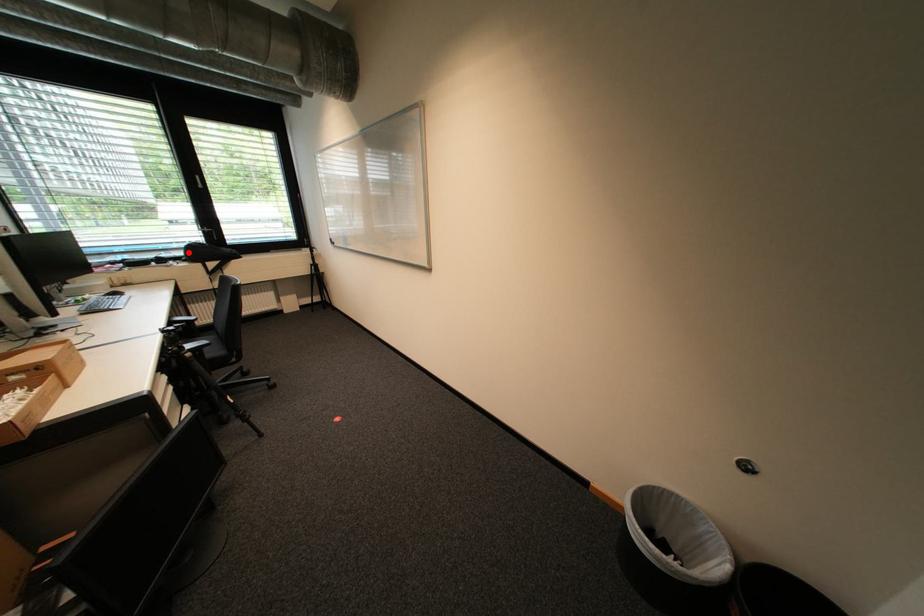
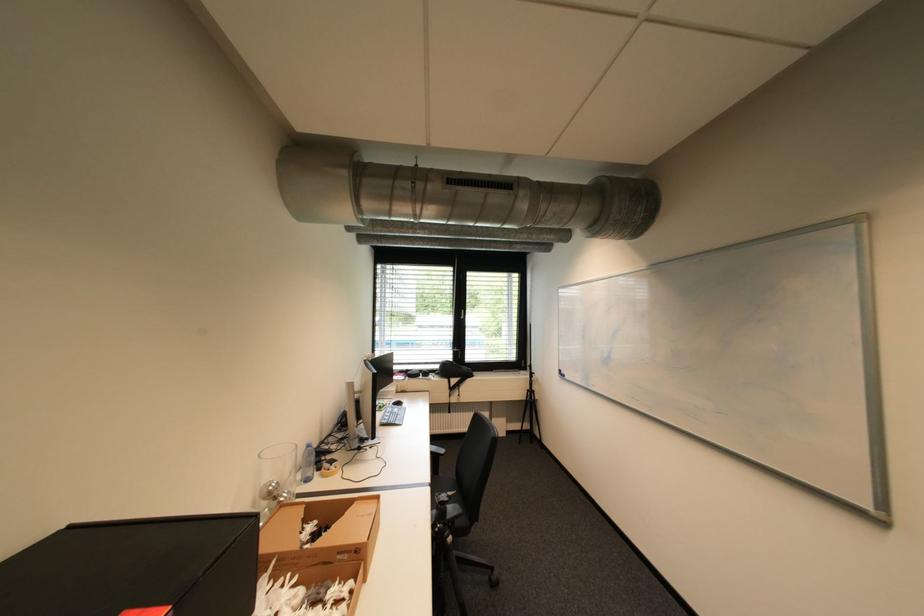
Question: I am providing you with two images of the same scene from different viewpoints. A red point is shown in image1. For the corresponding object point in image2, is it positioned nearer or farther from the camera?

Choices:
 (A) Nearer
 (B) Farther

Answer: (B)